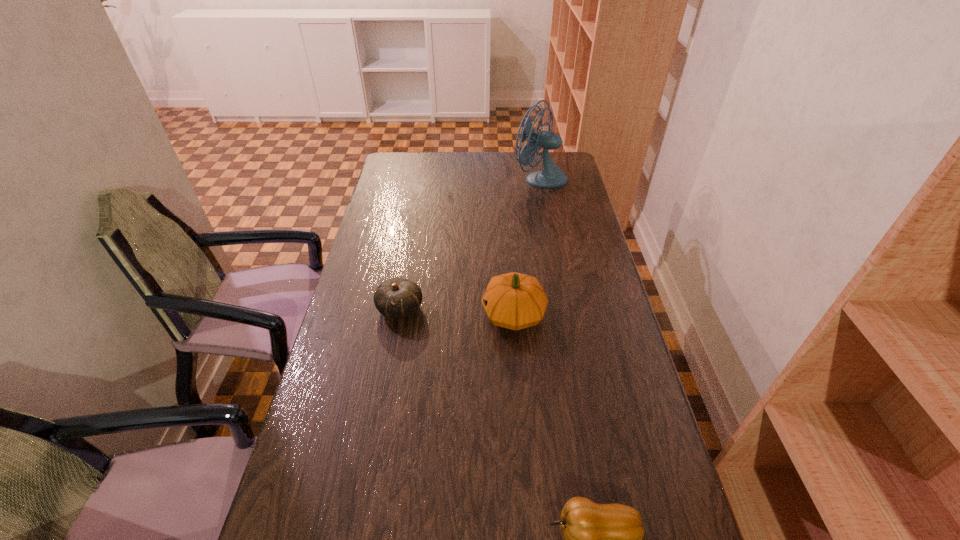
The width and height of the screenshot is (960, 540). I want to click on vacant point located between the tallest object and the tallest gourd, so click(527, 246).

The height and width of the screenshot is (540, 960). Identify the location of empty location between the farthest object and the leftmost object. (470, 244).

Image resolution: width=960 pixels, height=540 pixels. Identify the location of free space between the third shortest object and the farthest object. [527, 246].

Select which object is the third closest to the leftmost object. Please provide its 2D coordinates. Your answer should be formatted as a tuple, i.e. [(x, y)], where the tuple contains the x and y coordinates of a point satisfying the conditions above.

[(551, 176)]

This screenshot has height=540, width=960. I want to click on object that is the second nearest to the fan, so click(x=397, y=297).

Locate which gourd is the second closest to the second tallest object. Please provide its 2D coordinates. Your answer should be formatted as a tuple, i.e. [(x, y)], where the tuple contains the x and y coordinates of a point satisfying the conditions above.

[(599, 539)]

Find the location of a particular element. This screenshot has width=960, height=540. gourd that is the closest to the leftmost gourd is located at coordinates (515, 301).